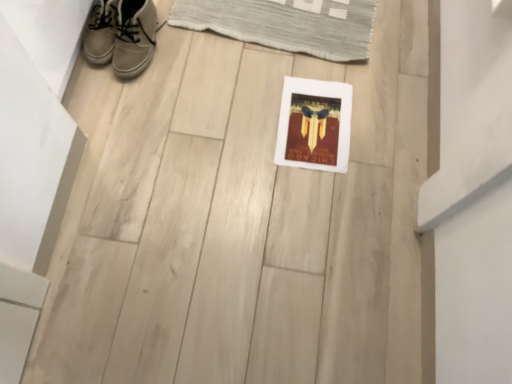
Question: Is leather sneaker at upper left, the 2th footwear in the right-to-left sequence, bigger or smaller than white leather sneakers at upper left, the first footwear in the right-to-left sequence?

Choices:
 (A) big
 (B) small

Answer: (B)

Question: Is leather sneaker at upper left, the 2th footwear in the right-to-left sequence, inside or outside of white leather sneakers at upper left, which is the 2th footwear from left to right?

Choices:
 (A) outside
 (B) inside

Answer: (A)

Question: Estimate the real-world distances between objects in this image. Which object is farther from the white matte picture frame at center?

Choices:
 (A) leather sneaker at upper left, the 2th footwear in the right-to-left sequence
 (B) white leather sneakers at upper left, which is the 2th footwear from left to right

Answer: (A)

Question: Based on their relative distances, which object is nearer to the white leather sneakers at upper left, the first footwear in the right-to-left sequence?

Choices:
 (A) white matte picture frame at center
 (B) leather sneaker at upper left, the 2th footwear in the right-to-left sequence

Answer: (B)